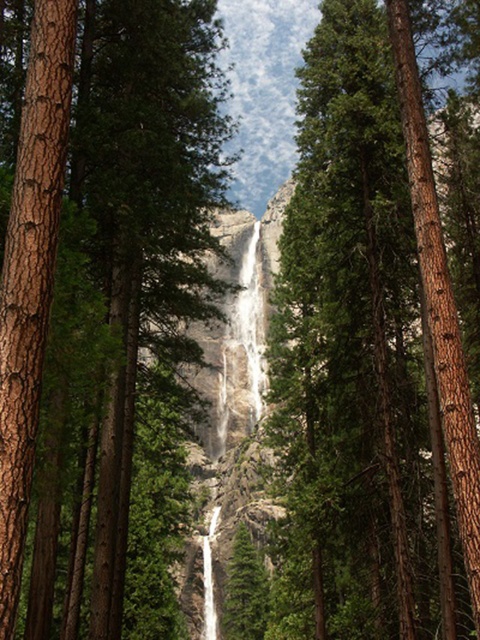
You are standing in front of the waterfall and notice two trees at the center. Which tree, the brown rough bark tree at center or the green rough bark tree at center, is positioned to the left?

The brown rough bark tree at center is positioned to the left of the green rough bark tree at center.

You are standing at the origin point of the coordinate system in the image. Can you see the brown rough bark tree at center from your current position?

The brown rough bark tree at center is located at point (103, 278), which is outside the origin point. Therefore, you cannot see the brown rough bark tree at center from your current position.

You are an environmental scientist assessing tree sizes in a forest. You observe a brown rough bark tree at center and a green rough bark tree at center. Which tree would you measure as having a larger diameter?

The brown rough bark tree at center is bigger than the green rough bark tree at center, so the brown rough bark tree at center has a larger diameter.